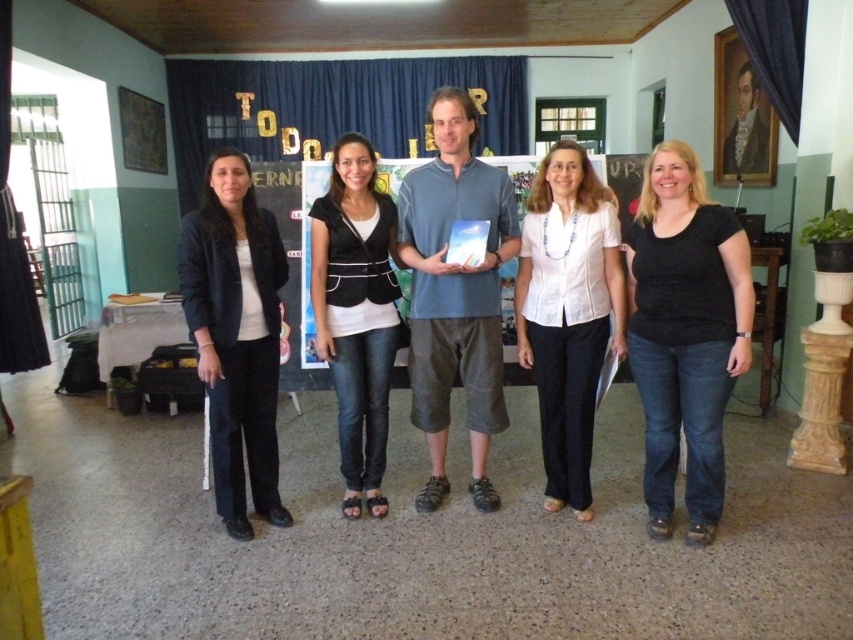
Does point (737, 292) come closer to viewer compared to point (387, 390)?

That is True.

What do you see at coordinates (685, 332) in the screenshot? This screenshot has height=640, width=853. I see `black matte shirt at center` at bounding box center [685, 332].

I want to click on black matte shirt at center, so click(685, 332).

Between black matte shirt at center and matte black blazer at left, which one appears on the right side from the viewer's perspective?

black matte shirt at center is more to the right.

Between point (734, 372) and point (270, 474), which one is positioned behind?

The point (270, 474) is more distant.

I want to click on black matte shirt at center, so click(x=685, y=332).

At what (x,y) coordinates should I click in order to perform the action: click on black matte shirt at center. Please return your answer as a coordinate pair (x, y). This screenshot has width=853, height=640. Looking at the image, I should click on (685, 332).

In the scene shown: Is white matte blouse at center positioned at the back of black velvet vest at center?

That is False.

Can you confirm if white matte blouse at center is positioned to the left of black velvet vest at center?

In fact, white matte blouse at center is to the right of black velvet vest at center.

Does point (537, 260) come in front of point (329, 179)?

That is True.

The width and height of the screenshot is (853, 640). Find the location of `white matte blouse at center`. white matte blouse at center is located at coordinates 567,312.